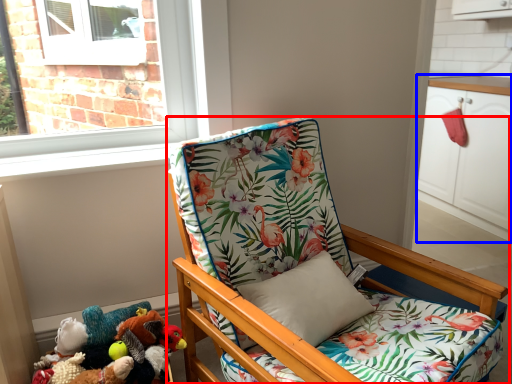
Question: Which object appears farthest to the camera in this image, chair (highlighted by a red box) or cabinetry (highlighted by a blue box)?

Choices:
 (A) chair
 (B) cabinetry

Answer: (B)